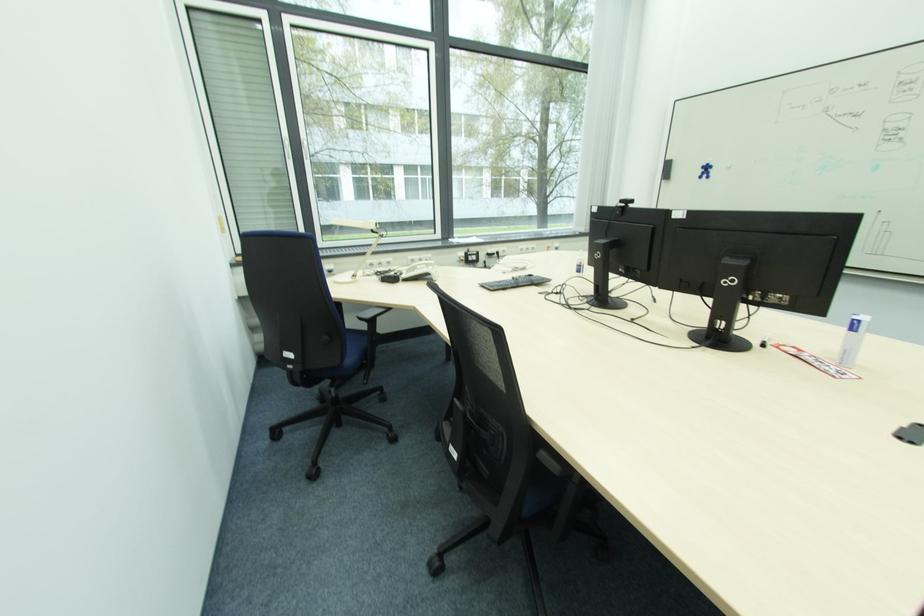
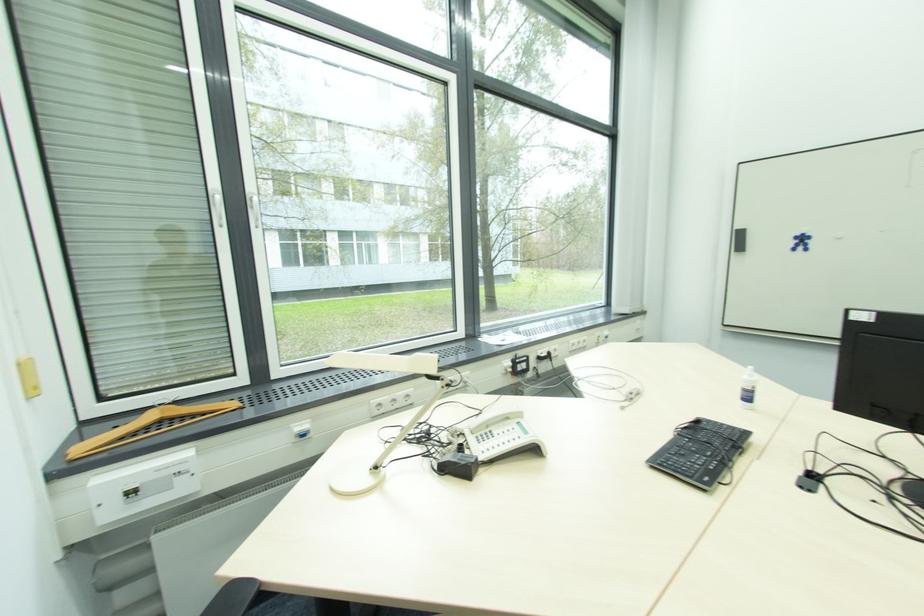
Where in the second image is the point corresponding to (x=707, y=172) from the first image?

(801, 244)